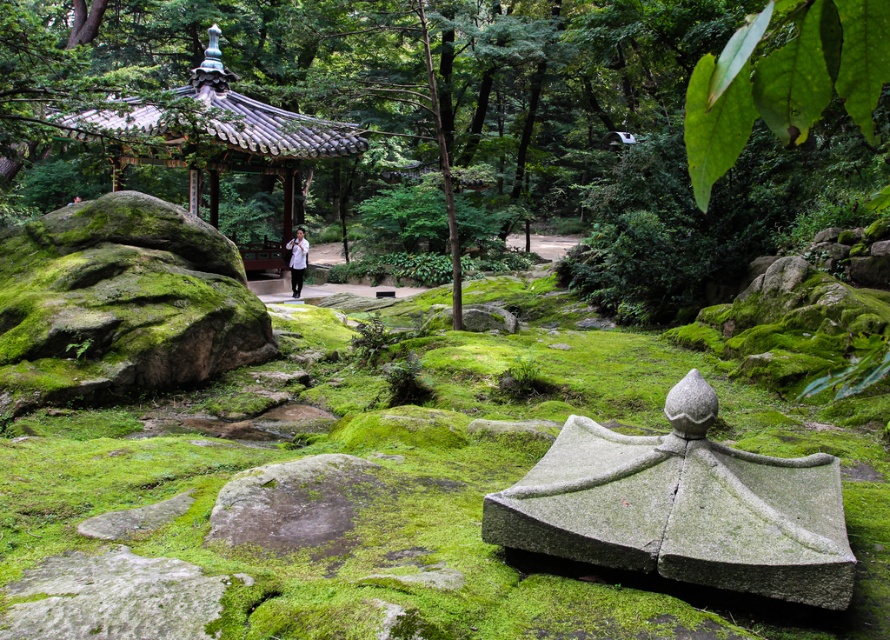
Question: From the image, what is the correct spatial relationship of shiny dark gray gazebo at center in relation to white matte shirt at center?

Choices:
 (A) right
 (B) left

Answer: (B)

Question: Where is green mossy rock at center located in relation to shiny dark gray gazebo at center in the image?

Choices:
 (A) right
 (B) left

Answer: (A)

Question: Can you confirm if green mossy rock at center is positioned above white matte shirt at center?

Choices:
 (A) no
 (B) yes

Answer: (B)

Question: Which of the following is the closest to the observer?

Choices:
 (A) coord(228,106)
 (B) coord(714,160)

Answer: (B)

Question: Which of the following is the farthest from the observer?

Choices:
 (A) (217, 90)
 (B) (295, 276)

Answer: (A)

Question: Which of these objects is positioned farthest from the white matte shirt at center?

Choices:
 (A) shiny dark gray gazebo at center
 (B) green mossy rock at center

Answer: (B)